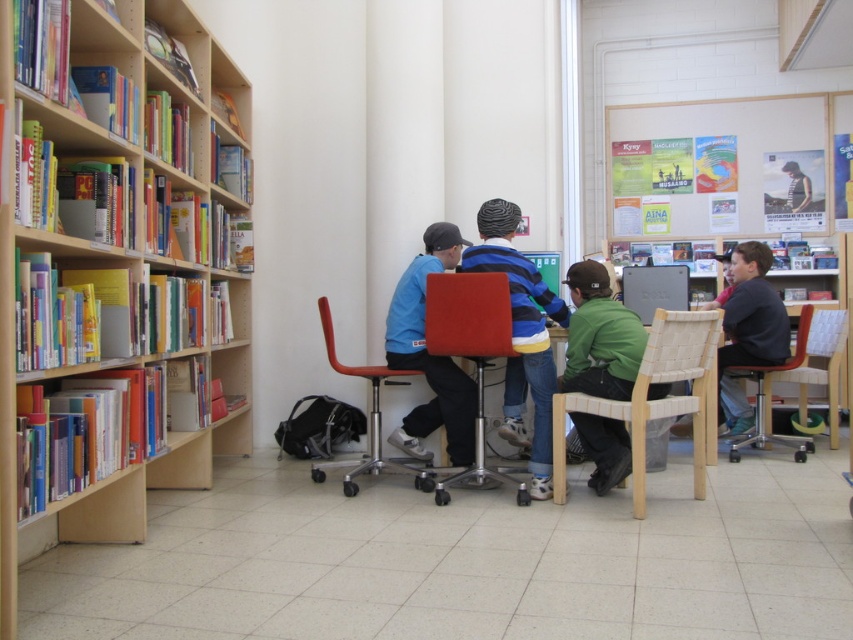
Question: Is woven wood chair at center smaller than red fabric chair at center?

Choices:
 (A) no
 (B) yes

Answer: (A)

Question: Which point is farther to the camera?

Choices:
 (A) (427, 468)
 (B) (756, 333)

Answer: (B)

Question: Observing the image, what is the correct spatial positioning of woven wood chair at center in reference to red fabric chair at center?

Choices:
 (A) below
 (B) above

Answer: (A)

Question: Which point is closer to the camera taking this photo?

Choices:
 (A) (843, 316)
 (B) (323, 316)

Answer: (B)

Question: Which object is the farthest from the wooden bookshelf at left?

Choices:
 (A) matte plastic chair at center
 (B) matte blue shirt at center
 (C) wooden chair at right

Answer: (C)

Question: Is wooden bookshelf at left wider than matte plastic chair at right?

Choices:
 (A) yes
 (B) no

Answer: (B)